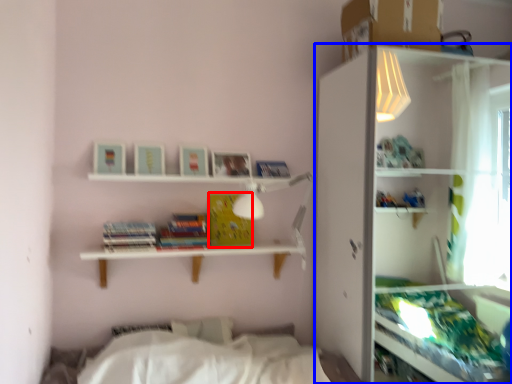
Question: Which of the following is the closest to the observer, paperback book (highlighted by a red box) or shelf (highlighted by a blue box)?

Choices:
 (A) paperback book
 (B) shelf

Answer: (B)